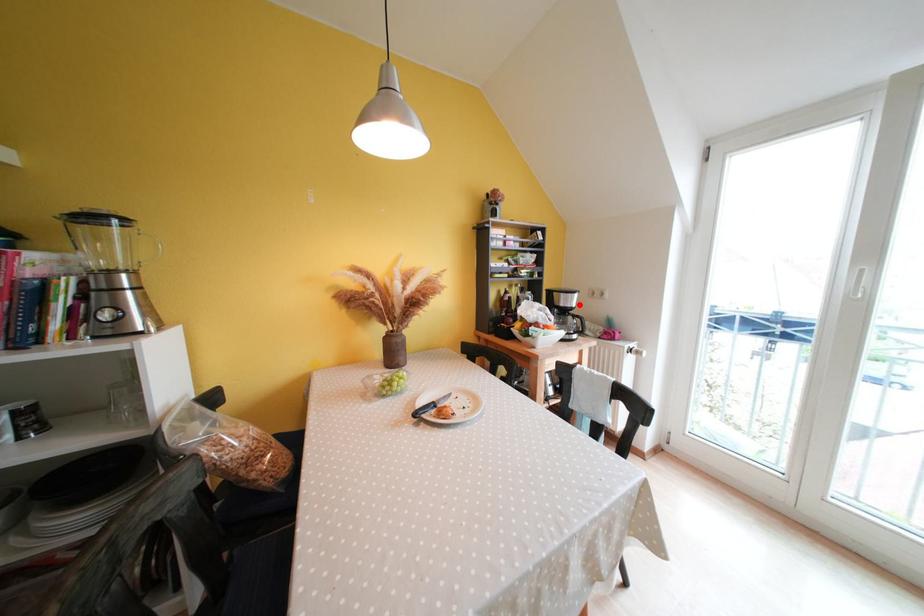
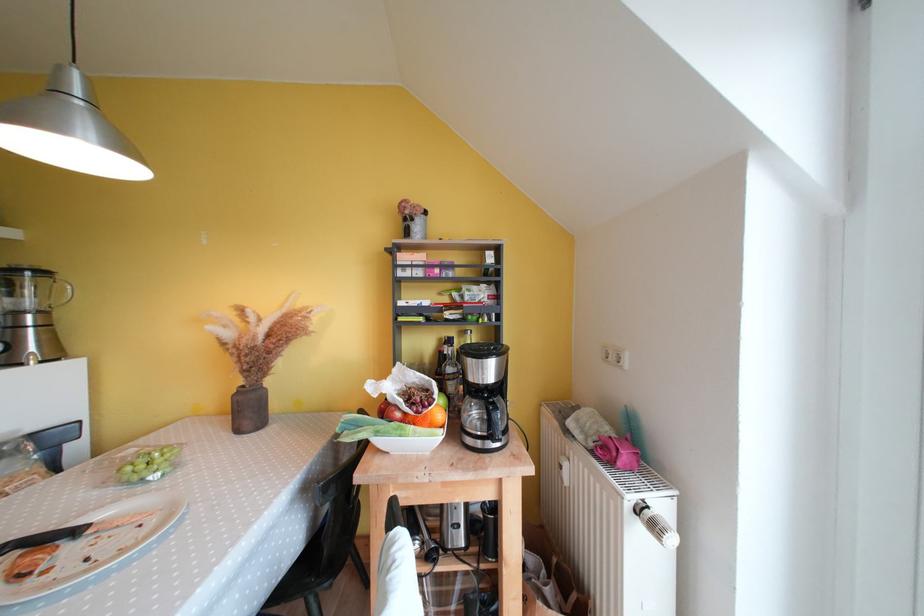
Where in the second image is the point corresponding to the highlighted location from the first image?

(494, 376)